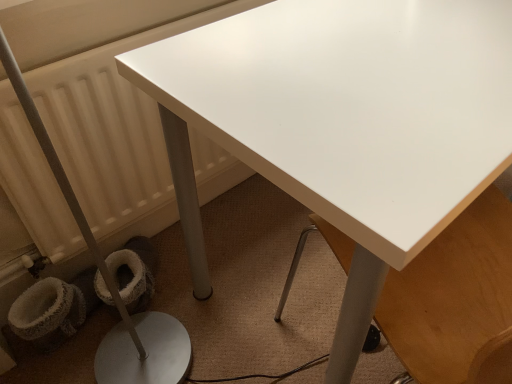
The image size is (512, 384). What do you see at coordinates (112, 128) in the screenshot?
I see `white plastic radiator at upper left` at bounding box center [112, 128].

Identify the location of white plastic radiator at upper left. This screenshot has width=512, height=384. [112, 128].

The width and height of the screenshot is (512, 384). What are the coordinates of `white plastic radiator at upper left` in the screenshot? It's located at (112, 128).